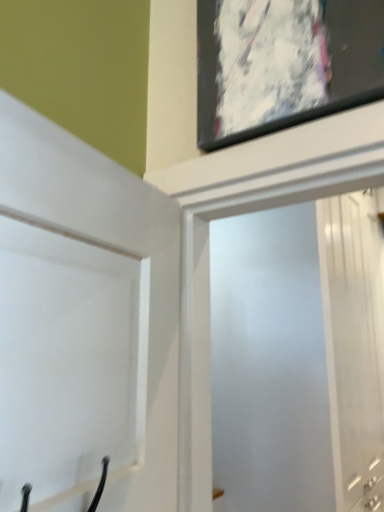
What do you see at coordinates (84, 324) in the screenshot?
I see `white matte door at upper left` at bounding box center [84, 324].

You are a GUI agent. You are given a task and a screenshot of the screen. Output one action in this format:
    pyautogui.click(x=<x>, y=<y>)
    Task: Click on the white matte door at upper left
    This screenshot has width=384, height=512.
    Given the screenshot: What is the action you would take?
    pyautogui.click(x=84, y=324)

At what (x,y) coordinates should I click in order to perform the action: click on frosted glass screen door at upper center. Please return your answer as a coordinate pair (x, y). The width and height of the screenshot is (384, 512). Looking at the image, I should click on (287, 357).

What is the approximate height of frosted glass screen door at upper center?

The height of frosted glass screen door at upper center is 2.15 meters.

What do you see at coordinates (287, 357) in the screenshot? I see `frosted glass screen door at upper center` at bounding box center [287, 357].

Measure the distance between point (244, 473) and camera.

Point (244, 473) is 5.62 feet away from camera.

At what (x,y) coordinates should I click in order to perform the action: click on white matte door at upper left. Please return your answer as a coordinate pair (x, y). This screenshot has height=512, width=384. Looking at the image, I should click on (84, 324).

From the picture: Between frosted glass screen door at upper center and white matte door at upper left, which one appears on the left side from the viewer's perspective?

white matte door at upper left.

Looking at this image, is frosted glass screen door at upper center positioned in front of white matte door at upper left?

No, the depth of frosted glass screen door at upper center is greater than that of white matte door at upper left.

Which is nearer, (360, 449) or (30, 159)?

Point (30, 159)

From the image's perspective, relative to white matte door at upper left, is frosted glass screen door at upper center above or below?

Clearly, from the image's perspective, frosted glass screen door at upper center is below white matte door at upper left.

From a real-world perspective, which is physically above, frosted glass screen door at upper center or white matte door at upper left?

frosted glass screen door at upper center.

Between frosted glass screen door at upper center and white matte door at upper left, which one has larger width?

Wider between the two is frosted glass screen door at upper center.

In terms of height, does frosted glass screen door at upper center look taller or shorter compared to white matte door at upper left?

In the image, frosted glass screen door at upper center appears to be taller than white matte door at upper left.

Considering the sizes of objects frosted glass screen door at upper center and white matte door at upper left in the image provided, who is bigger, frosted glass screen door at upper center or white matte door at upper left?

Bigger between the two is frosted glass screen door at upper center.

Which is correct: frosted glass screen door at upper center is inside white matte door at upper left, or outside of it?

frosted glass screen door at upper center is not enclosed by white matte door at upper left.

Would you consider frosted glass screen door at upper center to be distant from white matte door at upper left?

Absolutely, frosted glass screen door at upper center is distant from white matte door at upper left.

Does frosted glass screen door at upper center turn towards white matte door at upper left?

No, frosted glass screen door at upper center is not turned towards white matte door at upper left.

The height and width of the screenshot is (512, 384). Find the location of `door below the frosted glass screen door at upper center (from a real-world perspective)`. door below the frosted glass screen door at upper center (from a real-world perspective) is located at coordinates (84, 324).

Considering the relative positions of white matte door at upper left and frosted glass screen door at upper center in the image provided, is white matte door at upper left to the left of frosted glass screen door at upper center from the viewer's perspective?

Yes, white matte door at upper left is to the left of frosted glass screen door at upper center.

Is white matte door at upper left positioned before frosted glass screen door at upper center?

Yes, white matte door at upper left is closer to the camera.

Which is nearer, (48, 290) or (267, 394)?

Point (48, 290)

From the image's perspective, which one is positioned lower, white matte door at upper left or frosted glass screen door at upper center?

frosted glass screen door at upper center, from the image's perspective.

From a real-world perspective, is white matte door at upper left positioned under frosted glass screen door at upper center based on gravity?

Yes, from a real-world perspective, white matte door at upper left is under frosted glass screen door at upper center.

Considering the relative sizes of white matte door at upper left and frosted glass screen door at upper center in the image provided, is white matte door at upper left wider than frosted glass screen door at upper center?

Incorrect, the width of white matte door at upper left does not surpass that of frosted glass screen door at upper center.

Can you confirm if white matte door at upper left is shorter than frosted glass screen door at upper center?

Yes.

Which of these two, white matte door at upper left or frosted glass screen door at upper center, is bigger?

With larger size is frosted glass screen door at upper center.

Would you say white matte door at upper left is inside or outside frosted glass screen door at upper center?

white matte door at upper left is spatially situated outside frosted glass screen door at upper center.

Based on the photo, can you see white matte door at upper left touching frosted glass screen door at upper center?

No.

Could you tell me if white matte door at upper left is turned towards frosted glass screen door at upper center?

No, white matte door at upper left is not oriented towards frosted glass screen door at upper center.

What's the angular difference between white matte door at upper left and frosted glass screen door at upper center's facing directions?

white matte door at upper left and frosted glass screen door at upper center are facing 9.4 degrees away from each other.

How distant is white matte door at upper left from frosted glass screen door at upper center?

white matte door at upper left and frosted glass screen door at upper center are 1.20 meters apart from each other.

Find the location of `screen door below the white matte door at upper left (from the image's perspective)`. screen door below the white matte door at upper left (from the image's perspective) is located at coordinates (287, 357).

This screenshot has height=512, width=384. In order to click on screen door behind the white matte door at upper left in this screenshot , I will do `click(287, 357)`.

Locate an element on the screen. The height and width of the screenshot is (512, 384). door below the frosted glass screen door at upper center (from a real-world perspective) is located at coordinates (84, 324).